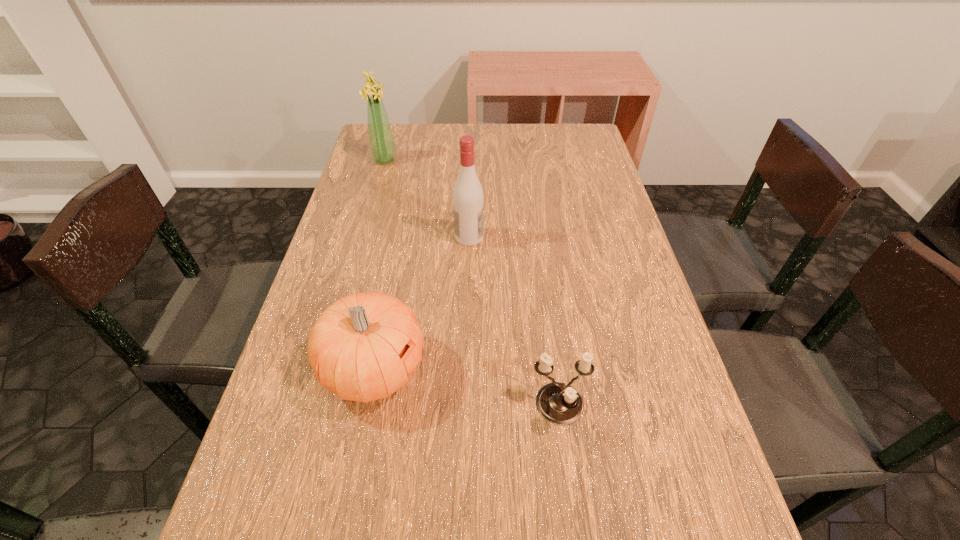
In order to click on bouquet in this screenshot , I will do `click(382, 146)`.

Locate an element on the screen. the third object from left to right is located at coordinates (468, 198).

Find the location of a particular element. the second farthest object is located at coordinates (468, 198).

At what (x,y) coordinates should I click in order to perform the action: click on the third tallest object. Please return your answer as a coordinate pair (x, y). Looking at the image, I should click on (363, 347).

At what (x,y) coordinates should I click in order to perform the action: click on the rightmost object. Please return your answer as a coordinate pair (x, y). The image size is (960, 540). Looking at the image, I should click on (560, 404).

Locate an element on the screen. the shortest object is located at coordinates tap(560, 404).

You are a GUI agent. You are given a task and a screenshot of the screen. Output one action in this format:
    pyautogui.click(x=<x>, y=<y>)
    Task: Click on the free location located 0.380m on the front-facing side of the bouquet
    The width and height of the screenshot is (960, 540).
    Given the screenshot: What is the action you would take?
    pyautogui.click(x=516, y=160)

You are a GUI agent. You are given a task and a screenshot of the screen. Output one action in this format:
    pyautogui.click(x=<x>, y=<y>)
    Task: Click on the vacant space situated on the label of the third object from left to right
    
    Given the screenshot: What is the action you would take?
    pyautogui.click(x=626, y=237)

Where is `free location located on the front-facing side of the pumpkin`? free location located on the front-facing side of the pumpkin is located at coordinates (618, 369).

Locate an element on the screen. Image resolution: width=960 pixels, height=540 pixels. vacant space situated 0.220m on the left of the candle holder is located at coordinates (413, 407).